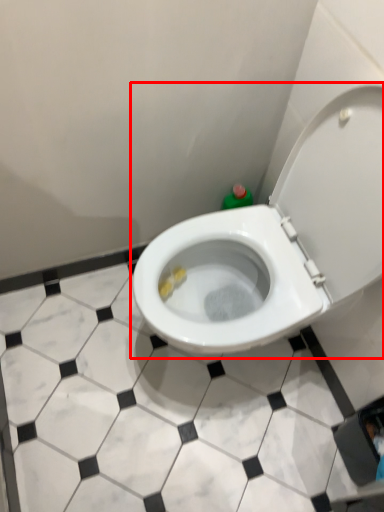
Question: From the image's perspective, considering the relative positions of toilet (annotated by the red box) and tile in the image provided, where is toilet (annotated by the red box) located with respect to the staircase?

Choices:
 (A) above
 (B) below

Answer: (A)